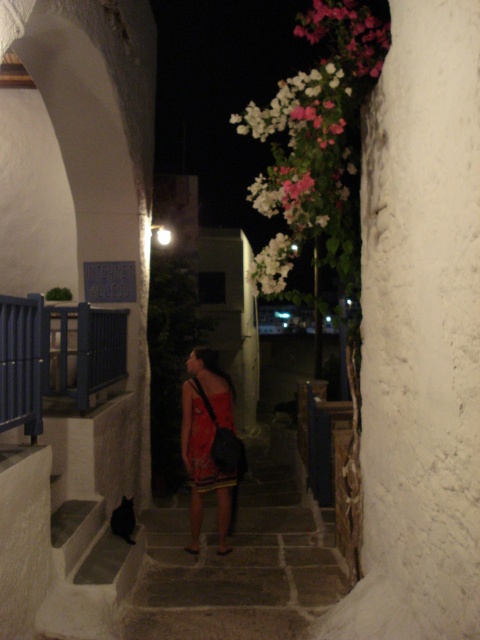
Question: Is dark gray stone stairs at center positioned in front of blue painted wood balustrade at left?

Choices:
 (A) no
 (B) yes

Answer: (A)

Question: Which object appears farthest from the camera in this image?

Choices:
 (A) blue painted wood balustrade at left
 (B) dark gray stone stairs at center
 (C) red satin dress at center
 (D) white rough textured pillar at center right

Answer: (B)

Question: Is blue painted wood balustrade at left bigger than red satin dress at center?

Choices:
 (A) no
 (B) yes

Answer: (B)

Question: Does white rough textured pillar at center right have a larger size compared to red satin dress at center?

Choices:
 (A) yes
 (B) no

Answer: (A)

Question: Which object is positioned closest to the red satin dress at center?

Choices:
 (A) blue painted wood balustrade at left
 (B) dark gray stone stairs at center

Answer: (B)

Question: Which object is closer to the camera taking this photo?

Choices:
 (A) red satin dress at center
 (B) blue painted wood balustrade at left

Answer: (B)